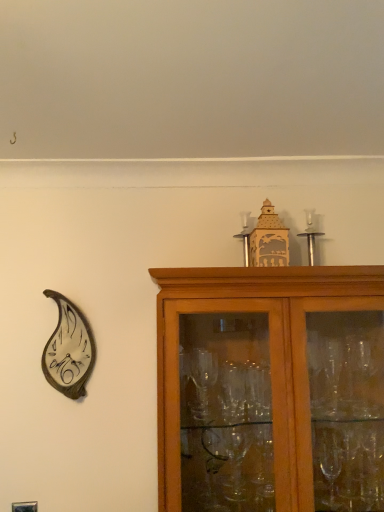
Question: Based on their sizes in the image, would you say silver metallic candle holder at upper center, which is the second candle holder from left to right, is bigger or smaller than metallic leaf-shaped clock at left?

Choices:
 (A) big
 (B) small

Answer: (B)

Question: In the image, is silver metallic candle holder at upper center, the first candle holder in the right-to-left sequence, on the left side or the right side of metallic leaf-shaped clock at left?

Choices:
 (A) left
 (B) right

Answer: (B)

Question: Estimate the real-world distances between objects in this image. Which object is closer to the brown wooden cabinet at upper right?

Choices:
 (A) silver metallic candle holder at upper center, the first candle holder in the right-to-left sequence
 (B) silver metallic candle holder at upper center, the 2th candle holder when ordered from right to left
 (C) metallic leaf-shaped clock at left

Answer: (A)

Question: Estimate the real-world distances between objects in this image. Which object is closer to the silver metallic candle holder at upper center, the first candle holder in the right-to-left sequence?

Choices:
 (A) brown wooden cabinet at upper right
 (B) metallic leaf-shaped clock at left
 (C) silver metallic candle holder at upper center, acting as the 1th candle holder starting from the left

Answer: (C)